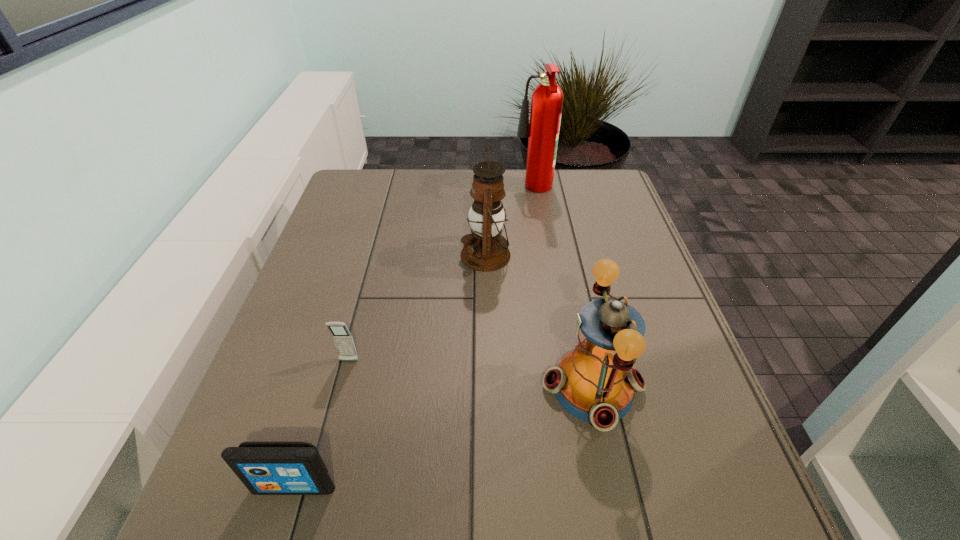
Image resolution: width=960 pixels, height=540 pixels. Identify the location of vacant space located at the nozzle of the fire extinguisher. (481, 191).

Identify the location of free space located on the side of the left lantern, there is a wick adjustment knob. Image resolution: width=960 pixels, height=540 pixels. (314, 255).

Locate an element on the screen. The width and height of the screenshot is (960, 540). vacant space located on the side of the left lantern, there is a wick adjustment knob is located at coordinates 344,255.

Identify the location of free point located on the side of the left lantern, there is a wick adjustment knob. (336, 255).

Locate an element on the screen. This screenshot has height=540, width=960. free space located 0.380m on the front-facing side of the nearer lantern is located at coordinates (356, 387).

Locate an element on the screen. free space located on the front-facing side of the nearer lantern is located at coordinates (385, 387).

Where is `blank space located on the front-facing side of the nearer lantern`? This screenshot has height=540, width=960. blank space located on the front-facing side of the nearer lantern is located at coordinates (478, 387).

At what (x,y) coordinates should I click in order to perform the action: click on vacant space situated 0.200m on the front-facing side of the cellular telephone. Please return your answer as a coordinate pair (x, y). The height and width of the screenshot is (540, 960). Looking at the image, I should click on (324, 456).

Identify the location of vacant space located on the front screen of the iPod. The image size is (960, 540). (279, 535).

Locate an element on the screen. object at the far edge is located at coordinates (547, 99).